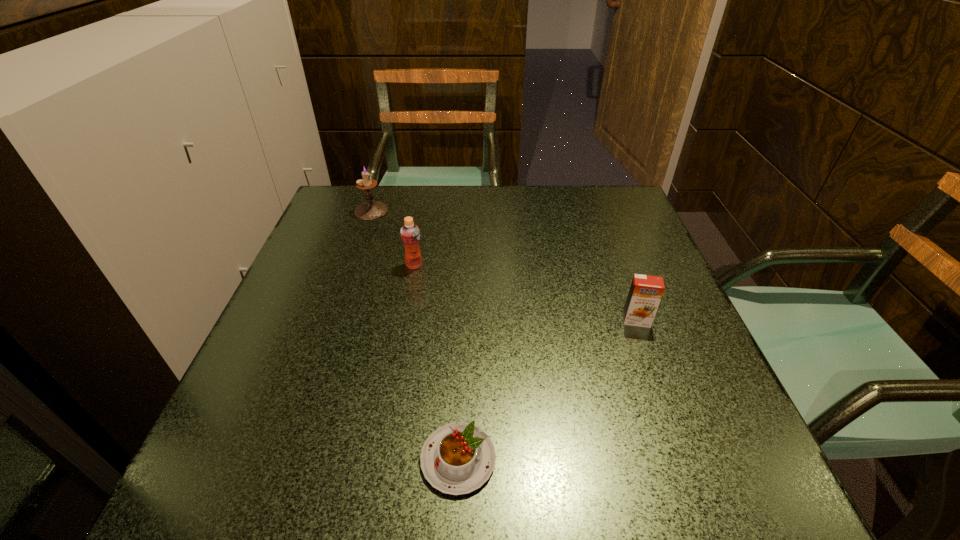
Where is `the leftmost object`? The width and height of the screenshot is (960, 540). the leftmost object is located at coordinates (371, 210).

Identify the location of the farthest object. The width and height of the screenshot is (960, 540). (371, 210).

This screenshot has height=540, width=960. What are the coordinates of `the second farthest object` in the screenshot? It's located at (410, 234).

The width and height of the screenshot is (960, 540). Identify the location of the second object from left to right. (410, 234).

Where is `the right orange juice`? the right orange juice is located at coordinates (646, 291).

The width and height of the screenshot is (960, 540). What are the coordinates of `the nearer orange juice` in the screenshot? It's located at (646, 291).

The width and height of the screenshot is (960, 540). Identify the location of the second object from right to left. (458, 458).

Locate an element on the screen. The image size is (960, 540). the shortest object is located at coordinates (458, 458).

This screenshot has width=960, height=540. In order to click on vacant space positioned 0.360m on the front of the leftmost object in this screenshot , I will do `click(333, 322)`.

Find the location of a particular element. The width and height of the screenshot is (960, 540). vacant region located on the front of the taller orange juice is located at coordinates (388, 413).